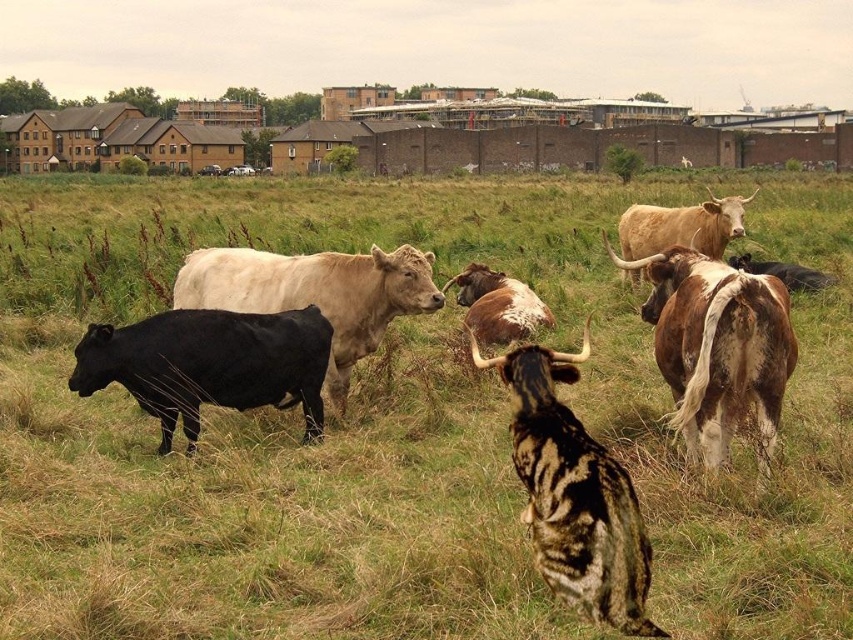
Question: Which point is farther to the camera?

Choices:
 (A) black glossy bull at left
 (B) light brown textured bull at upper right

Answer: (B)

Question: Which of the following is the closest to the observer?

Choices:
 (A) (636, 228)
 (B) (711, 320)
 (C) (457, 298)
 (D) (169, 380)

Answer: (B)

Question: Which point is farther to the camera?

Choices:
 (A) brown speckled hide at right
 (B) speckled brown bull at center

Answer: (A)

Question: Does brown speckled hide at right lie behind light brown textured bull at upper right?

Choices:
 (A) no
 (B) yes

Answer: (A)

Question: Can you confirm if speckled brown bull at center is positioned to the left of brown speckled hide at center?

Choices:
 (A) no
 (B) yes

Answer: (B)

Question: From the image, what is the correct spatial relationship of brown speckled hide at right in relation to black glossy bull at left?

Choices:
 (A) below
 (B) above

Answer: (B)